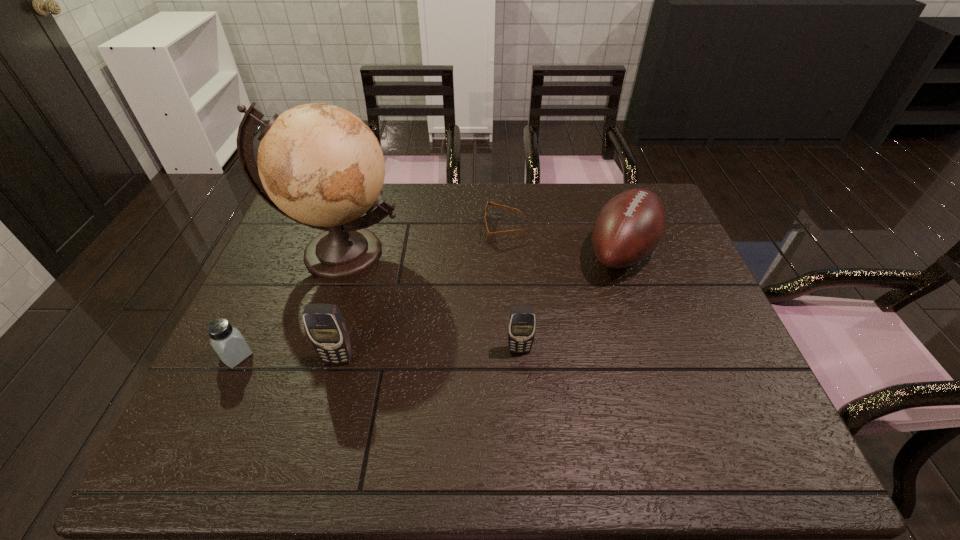
Where is `vacant region between the football (American) and the left cellular telephone`? This screenshot has height=540, width=960. vacant region between the football (American) and the left cellular telephone is located at coordinates (480, 305).

This screenshot has width=960, height=540. In order to click on vacant region between the right cellular telephone and the tallest object in this screenshot , I will do `click(430, 301)`.

Locate an element on the screen. vacant area that lies between the shorter cellular telephone and the taller cellular telephone is located at coordinates [x=429, y=354].

Find the location of `free space between the right cellular telephone and the second shortest object`. free space between the right cellular telephone and the second shortest object is located at coordinates (378, 353).

Where is `vacant area that lies between the shortest object and the globe`? This screenshot has width=960, height=540. vacant area that lies between the shortest object and the globe is located at coordinates (422, 240).

Where is `free space that is in between the shorter cellular telephone and the rightmost object`? free space that is in between the shorter cellular telephone and the rightmost object is located at coordinates (570, 300).

The width and height of the screenshot is (960, 540). I want to click on free space between the football (American) and the taller cellular telephone, so click(480, 305).

Find the location of a particular element. unoccupied area between the second shortest object and the globe is located at coordinates 289,304.

Where is `empty location between the second shortest object and the left cellular telephone`? Image resolution: width=960 pixels, height=540 pixels. empty location between the second shortest object and the left cellular telephone is located at coordinates (287, 357).

Find the location of a particular element. the fifth closest object to the left cellular telephone is located at coordinates (629, 227).